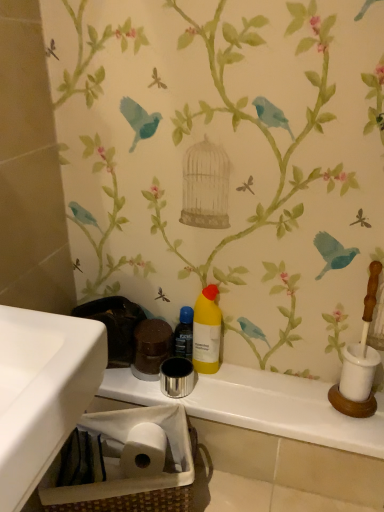
Question: Is woven brown basket at lower left wider than yellow matte bottle at center?

Choices:
 (A) yes
 (B) no

Answer: (A)

Question: From a real-world perspective, does woven brown basket at lower left sit lower than yellow matte bottle at center?

Choices:
 (A) yes
 (B) no

Answer: (A)

Question: Considering the relative positions of woven brown basket at lower left and yellow matte bottle at center in the image provided, is woven brown basket at lower left behind yellow matte bottle at center?

Choices:
 (A) yes
 (B) no

Answer: (B)

Question: Is woven brown basket at lower left looking in the opposite direction of yellow matte bottle at center?

Choices:
 (A) no
 (B) yes

Answer: (A)

Question: Can you confirm if woven brown basket at lower left is smaller than yellow matte bottle at center?

Choices:
 (A) no
 (B) yes

Answer: (A)

Question: Is woven brown basket at lower left directly adjacent to yellow matte bottle at center?

Choices:
 (A) no
 (B) yes

Answer: (A)

Question: Considering the relative positions of yellow matte bottle at center and metallic silver cup at center in the image provided, is yellow matte bottle at center behind metallic silver cup at center?

Choices:
 (A) no
 (B) yes

Answer: (B)

Question: Is yellow matte bottle at center oriented towards metallic silver cup at center?

Choices:
 (A) no
 (B) yes

Answer: (A)

Question: Is yellow matte bottle at center at the left side of metallic silver cup at center?

Choices:
 (A) no
 (B) yes

Answer: (B)

Question: Is yellow matte bottle at center not near metallic silver cup at center?

Choices:
 (A) yes
 (B) no

Answer: (B)

Question: Are yellow matte bottle at center and metallic silver cup at center beside each other?

Choices:
 (A) no
 (B) yes

Answer: (A)

Question: Considering the relative sizes of yellow matte bottle at center and metallic silver cup at center in the image provided, is yellow matte bottle at center taller than metallic silver cup at center?

Choices:
 (A) yes
 (B) no

Answer: (A)

Question: Is woven brown basket at lower left closer to the viewer compared to translucent plastic bottle at center?

Choices:
 (A) no
 (B) yes

Answer: (B)